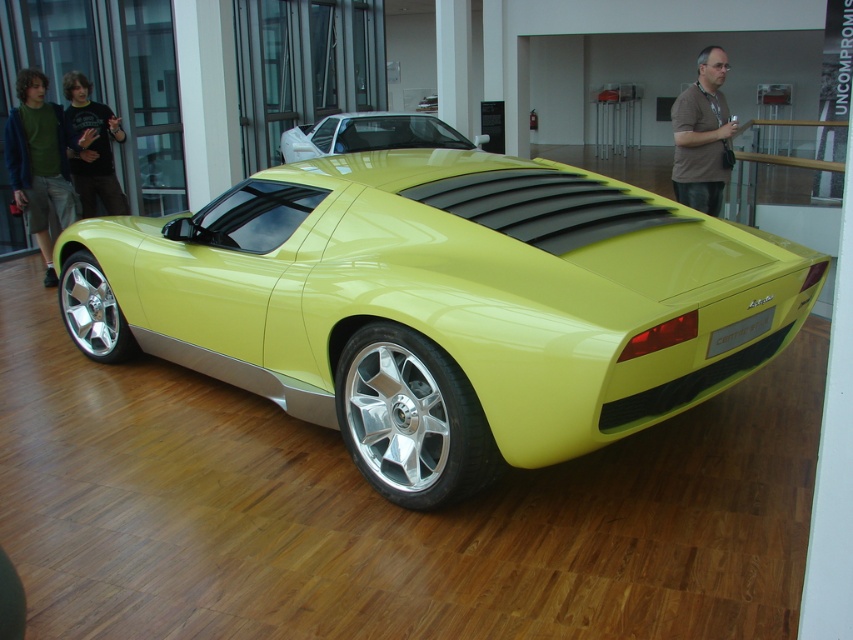
You are trying to decide which shirt to wear for a casual day out. You have two options in the image, the green cotton shirt at left and the brownmaterial shirt at right. Which one is bigger in size?

The green cotton shirt at left is larger in size compared to the brownmaterial shirt at right.

You are standing in the showroom and want to find the green cotton shirt at left. Where should you look relative to the yellow sports car?

The green cotton shirt at left is located at the lower left area near the front of the yellow sports car since its coordinates are at point (39, 163).

You are a customer in a clothing store and see two shirts displayed on mannequins. The green cotton shirt at left and the brownmaterial shirt at right. Which shirt is positioned lower on the mannequin?

The green cotton shirt at left is positioned lower on the mannequin because it is below the brownmaterial shirt at right.